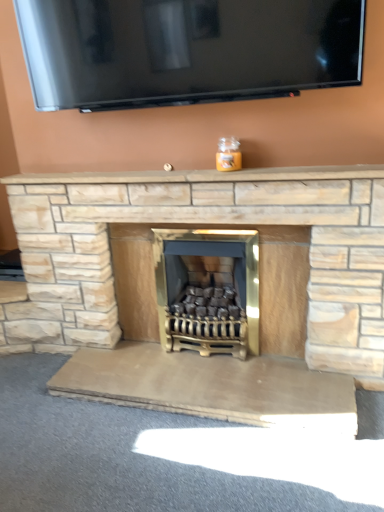
You are a GUI agent. You are given a task and a screenshot of the screen. Output one action in this format:
    pyautogui.click(x=<x>, y=<y>)
    Task: Click on the vacant space underneath beige stone mantle at center (from a real-world perspective)
    The image size is (384, 512).
    Given the screenshot: What is the action you would take?
    pyautogui.click(x=196, y=185)